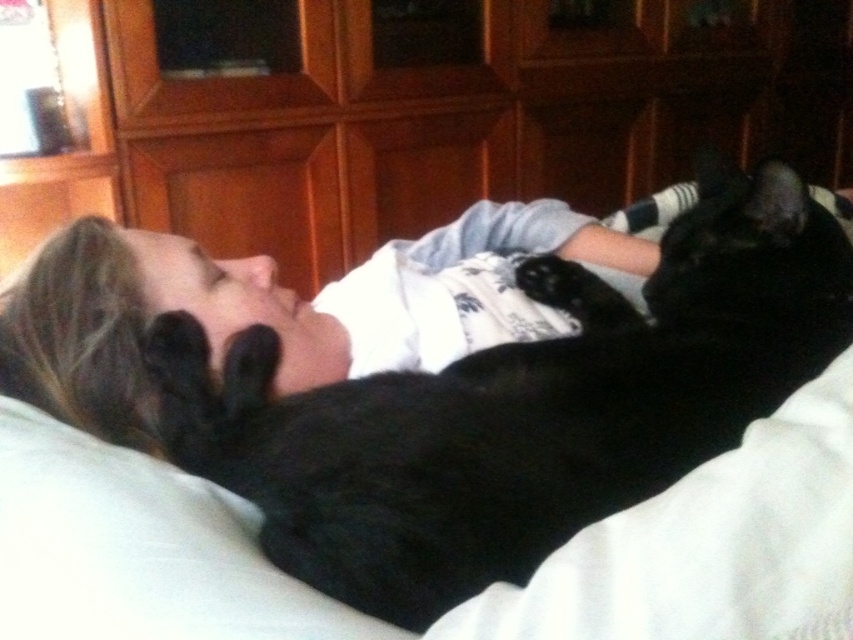
Question: Is black fur cat at upper center to the right of white soft pillow at upper left from the viewer's perspective?

Choices:
 (A) yes
 (B) no

Answer: (A)

Question: Is black fur cat at upper center to the left of white soft pillow at upper left from the viewer's perspective?

Choices:
 (A) yes
 (B) no

Answer: (B)

Question: Which object appears closest to the camera in this image?

Choices:
 (A) black fur cat at upper center
 (B) white soft pillow at upper left

Answer: (B)

Question: Which object appears closest to the camera in this image?

Choices:
 (A) white soft pillow at upper left
 (B) black fur cat at upper center

Answer: (A)

Question: From the image, what is the correct spatial relationship of black fur cat at upper center in relation to white soft pillow at upper left?

Choices:
 (A) left
 (B) right

Answer: (B)

Question: Among these points, which one is farthest from the camera?

Choices:
 (A) (25, 508)
 (B) (294, 412)

Answer: (B)